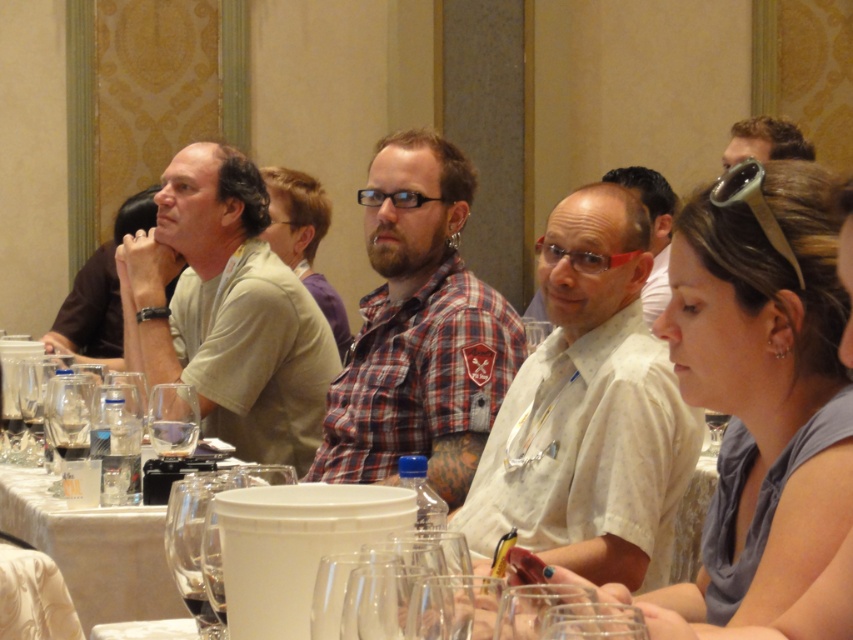
You are sitting at the table and want to reach both the point at coordinates (155, 426) and the point at coordinates (762, 131). Which point will you reach first if you extend your arm straight out?

You will reach the point at coordinates (155, 426) first because it is closer to you than the point at coordinates (762, 131).

You are standing at the center of the table and want to hand a document to the person wearing the light beige cotton shirt at left. In which direction should you move to reach them?

The light beige cotton shirt at left is located at point 0.486 on the x and 0.266 on the y coordinates, so you should move to the left side of the table to reach them.